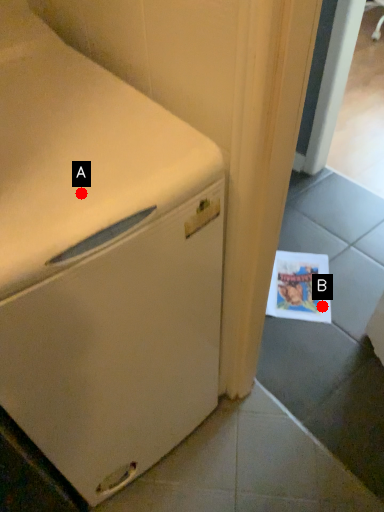
Question: Two points are circled on the image, labeled by A and B beside each circle. Among these points, which one is nearest to the camera?

Choices:
 (A) A is closer
 (B) B is closer

Answer: (A)